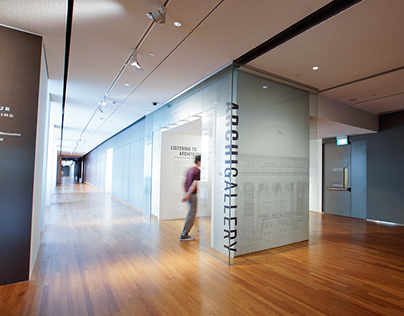
Where is `floor`? This screenshot has width=404, height=316. floor is located at coordinates (154, 298).